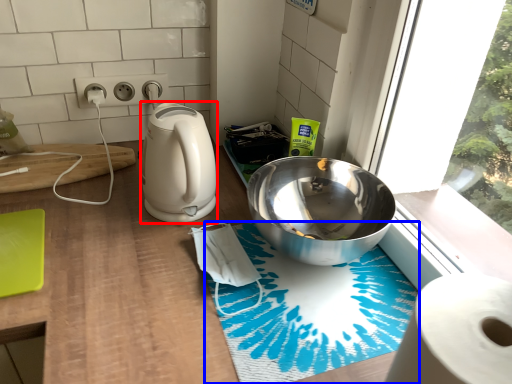
Question: Which point is further to the camera, kitchen appliance (highlighted by a red box) or bath mat (highlighted by a blue box)?

Choices:
 (A) kitchen appliance
 (B) bath mat

Answer: (A)